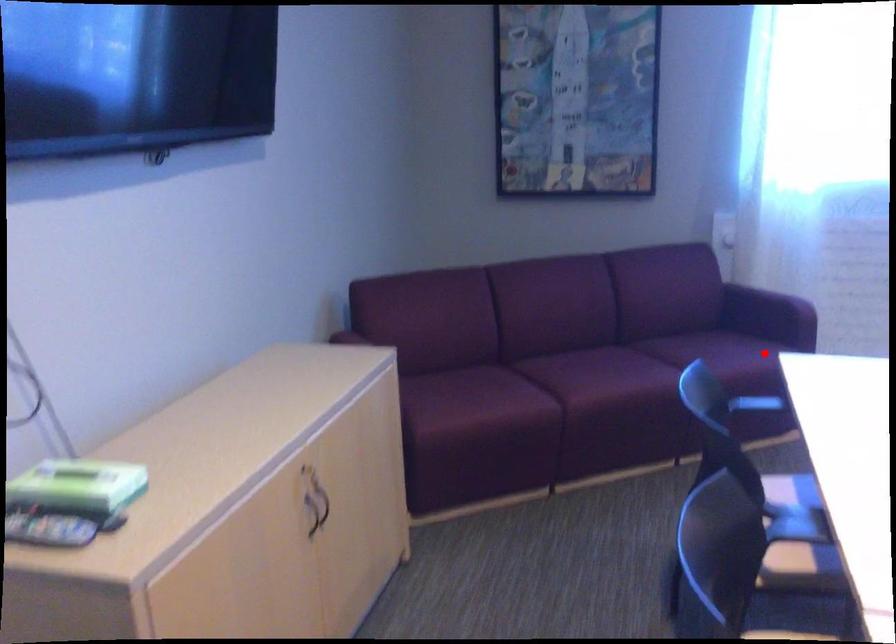
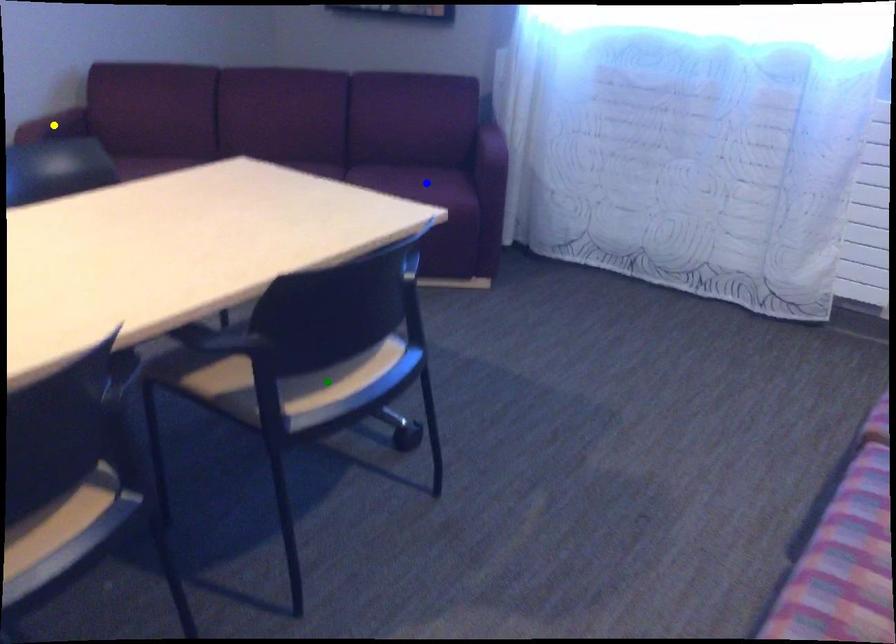
Question: I am providing you with two images of the same scene from different viewpoints. A red point is marked on the first image. You are given multiple points on the second image. Which point in image 2 is actually the same real-world point as the red point in image 1?

Choices:
 (A) green point
 (B) yellow point
 (C) blue point

Answer: (C)